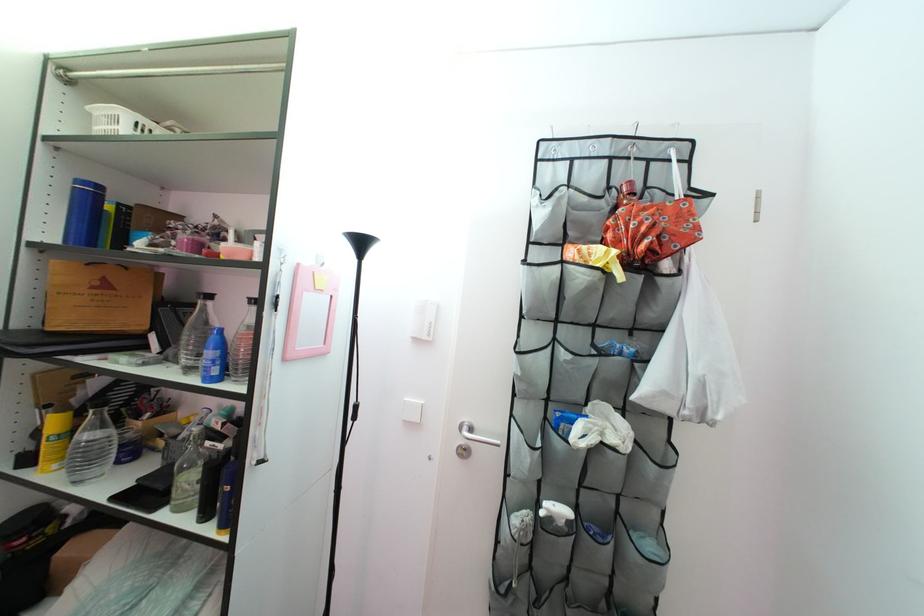
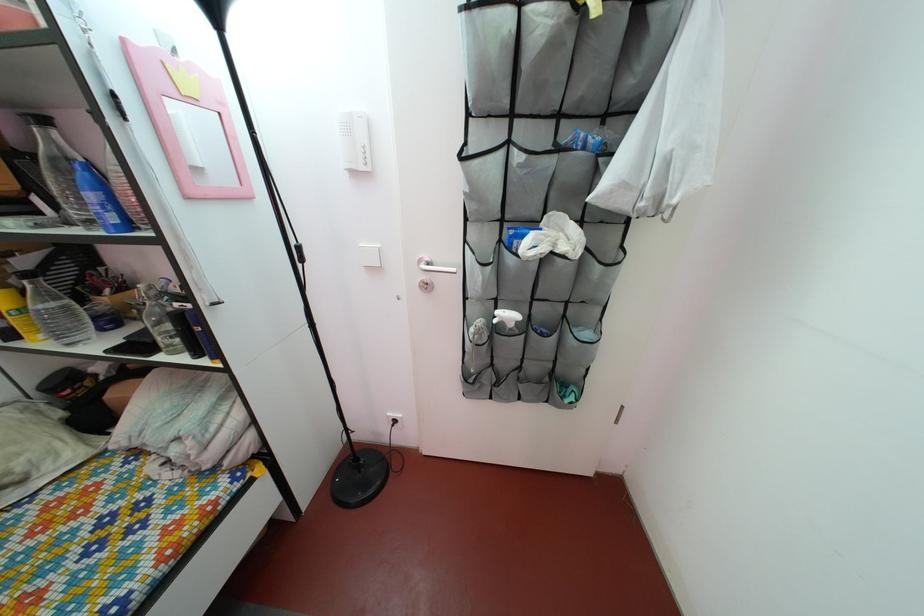
Where in the second image is the point corresponding to the point at 56,456 from the first image?

(27, 330)